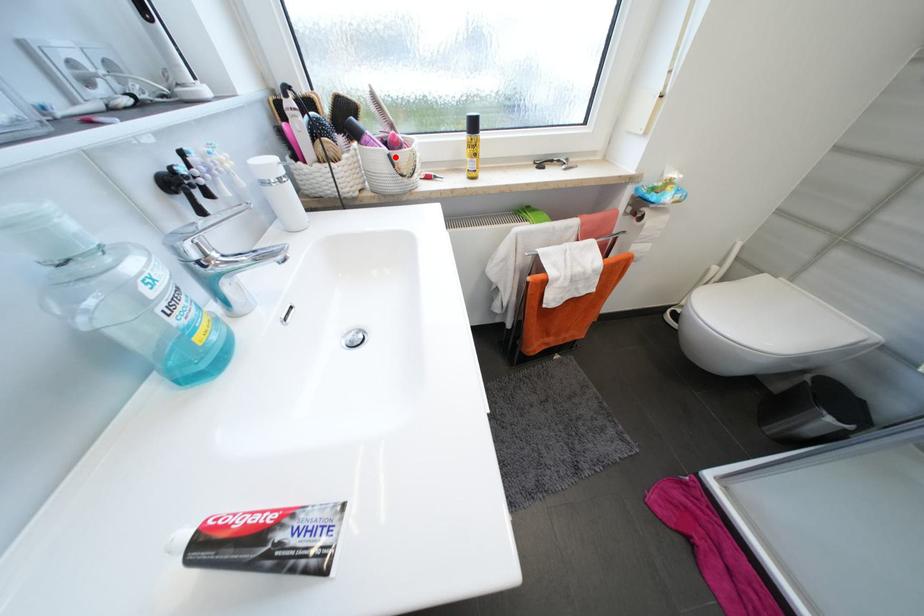
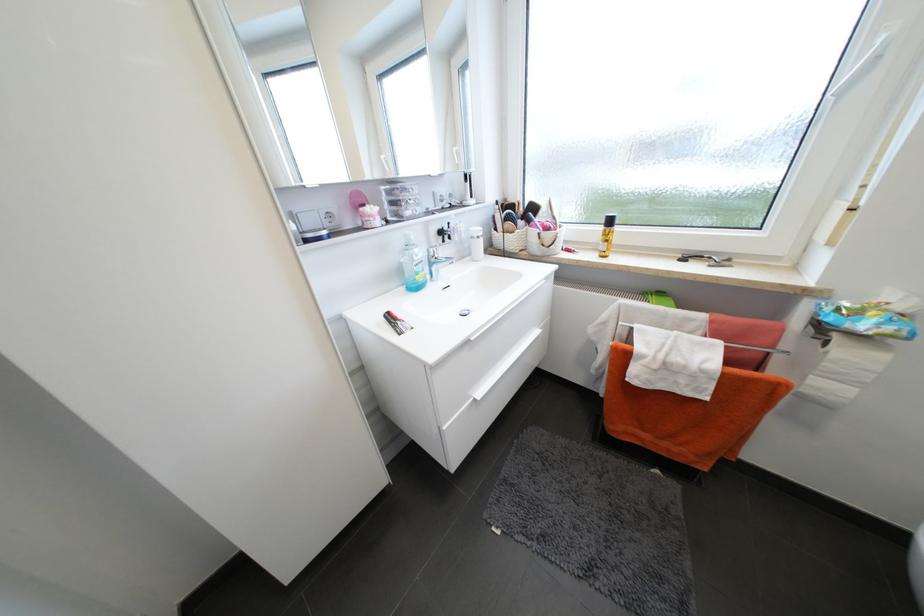
Where in the second image is the point corresponding to the highlighted location from the first image?

(544, 235)